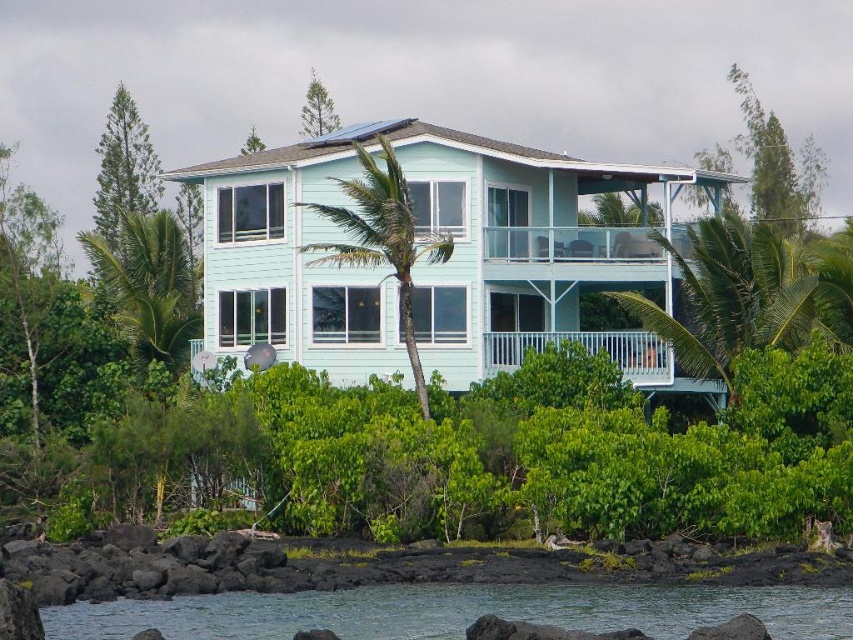
Question: Is green leafy palm tree at right smaller than green leafy palm tree at left?

Choices:
 (A) no
 (B) yes

Answer: (B)

Question: Which point is closer to the camera?

Choices:
 (A) clear water at lower center
 (B) green leafy palm tree at center
 (C) green leafy palm tree at right
 (D) green leafy palm tree at left

Answer: (A)

Question: Is green leafy palm tree at right above green leafy palm tree at center?

Choices:
 (A) no
 (B) yes

Answer: (A)

Question: Which object is the farthest from the green leafy palm tree at left?

Choices:
 (A) green leafy palm tree at center
 (B) clear water at lower center
 (C) green leafy palm tree at right

Answer: (B)

Question: Which point is farther from the camera taking this photo?

Choices:
 (A) (654, 589)
 (B) (144, 237)

Answer: (B)

Question: Observing the image, what is the correct spatial positioning of green leafy palm tree at right in reference to green leafy palm tree at left?

Choices:
 (A) left
 (B) right

Answer: (B)